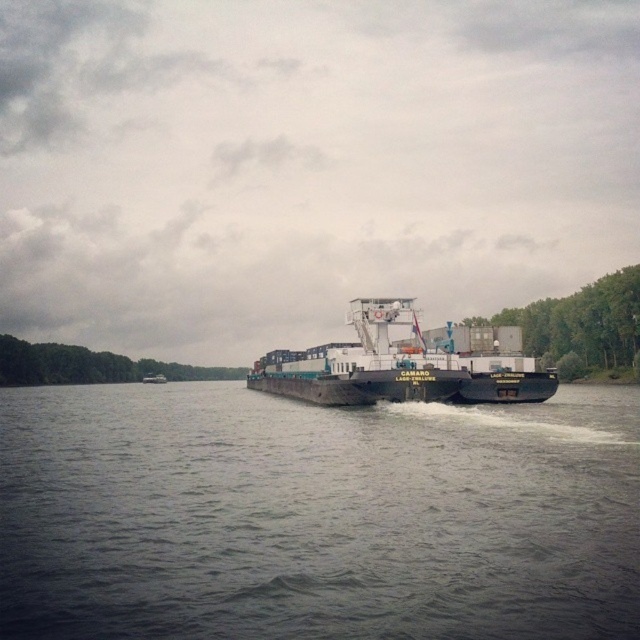
Does gray concrete river at center lie in front of white matte cargo ship at center?

Yes, it is.

Who is higher up, gray concrete river at center or white matte cargo ship at center?

white matte cargo ship at center is higher up.

Between point (396, 536) and point (532, 381), which one is positioned behind?

Positioned behind is point (532, 381).

What are the coordinates of `gray concrete river at center` in the screenshot? It's located at (316, 516).